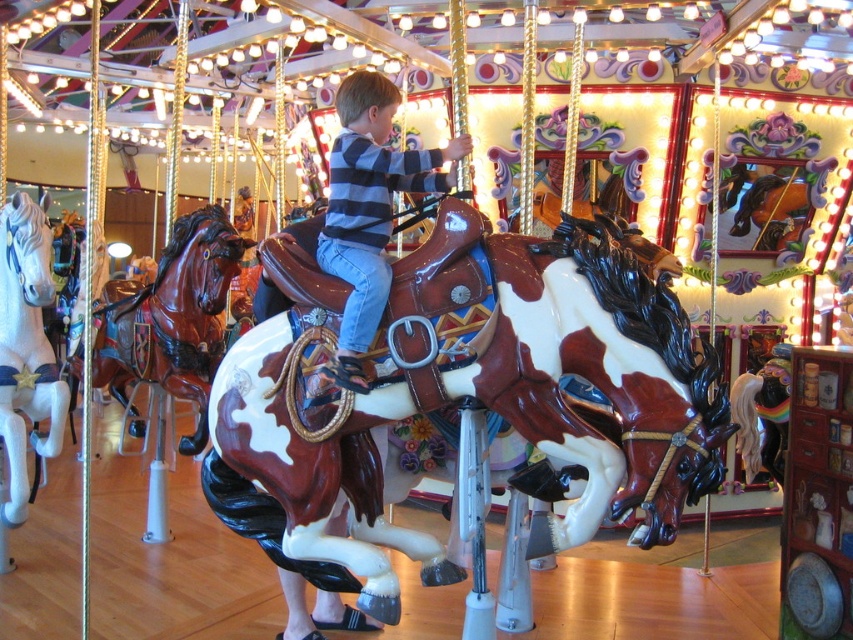
Question: Does striped cotton shirt at center have a smaller size compared to white glossy horse at left?

Choices:
 (A) no
 (B) yes

Answer: (B)

Question: Based on their relative distances, which object is farther from the white glossy horse at left?

Choices:
 (A) brown glossy horse at center
 (B) striped cotton shirt at center

Answer: (A)

Question: Which of these objects is positioned closest to the striped cotton shirt at center?

Choices:
 (A) brown glossy horse at center
 (B) brown glossy horse at left
 (C) white glossy horse at left

Answer: (A)

Question: Which point is closer to the camera?

Choices:
 (A) striped cotton shirt at center
 (B) brown glossy horse at left

Answer: (A)

Question: Is the position of brown glossy horse at left more distant than that of white glossy horse at left?

Choices:
 (A) no
 (B) yes

Answer: (B)

Question: Is brown glossy horse at center in front of brown glossy horse at left?

Choices:
 (A) no
 (B) yes

Answer: (B)